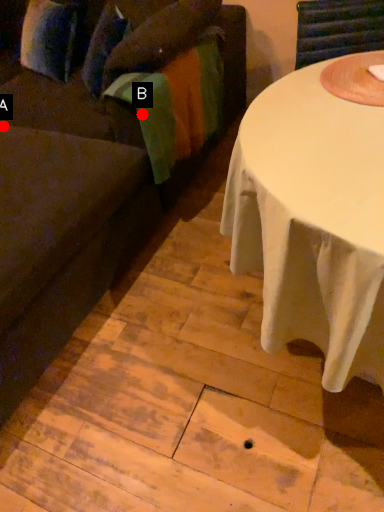
Question: Two points are circled on the image, labeled by A and B beside each circle. Which point is further to the camera?

Choices:
 (A) A is further
 (B) B is further

Answer: (A)